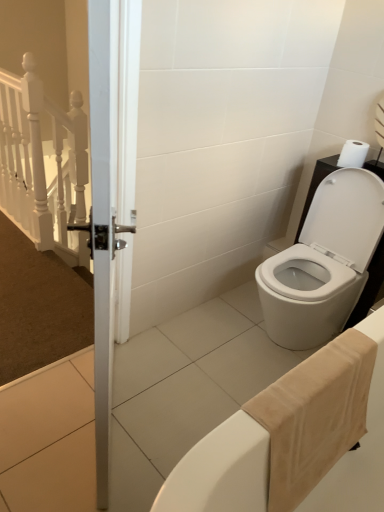
The width and height of the screenshot is (384, 512). What do you see at coordinates (323, 261) in the screenshot?
I see `white glossy toilet at lower right` at bounding box center [323, 261].

Where is `white glossy toilet at lower right`? This screenshot has height=512, width=384. white glossy toilet at lower right is located at coordinates point(323,261).

Measure the distance between point [362,150] and camera.

A distance of 6.33 feet exists between point [362,150] and camera.

The height and width of the screenshot is (512, 384). I want to click on white matte toilet paper at upper right, so click(x=353, y=154).

This screenshot has height=512, width=384. Describe the element at coordinates (314, 416) in the screenshot. I see `beige cotton bath towel at lower right` at that location.

Locate an element on the screen. This screenshot has width=384, height=512. white glossy toilet at lower right is located at coordinates (323, 261).

Consider the image. Is white glossy toilet at lower right positioned with its back to white matte toilet paper at upper right?

No.

Is white glossy toilet at lower right surrounding white matte toilet paper at upper right?

No.

Which object is further away from the camera taking this photo, white glossy toilet at lower right or white matte toilet paper at upper right?

white matte toilet paper at upper right is behind.

Is white glossy toilet at lower right wider or thinner than white matte toilet paper at upper right?

In the image, white glossy toilet at lower right appears to be wider than white matte toilet paper at upper right.

From the picture: From the image's perspective, is white matte toilet paper at upper right beneath beige cotton bath towel at lower right?

Actually, white matte toilet paper at upper right appears above beige cotton bath towel at lower right in the image.

Considering the sizes of objects white matte toilet paper at upper right and beige cotton bath towel at lower right in the image provided, who is smaller, white matte toilet paper at upper right or beige cotton bath towel at lower right?

Smaller between the two is white matte toilet paper at upper right.

From the picture: Considering the positions of objects white matte toilet paper at upper right and beige cotton bath towel at lower right in the image provided, who is in front, white matte toilet paper at upper right or beige cotton bath towel at lower right?

beige cotton bath towel at lower right is more forward.

What are the coordinates of `toilet paper on the right of beige cotton bath towel at lower right` in the screenshot? It's located at (353, 154).

Which object is thinner, beige cotton bath towel at lower right or white matte toilet paper at upper right?

With smaller width is white matte toilet paper at upper right.

What's the angular difference between beige cotton bath towel at lower right and white matte toilet paper at upper right's facing directions?

They differ by 92.2 degrees in their facing directions.

Where is `bath towel on the left of white matte toilet paper at upper right`? This screenshot has height=512, width=384. bath towel on the left of white matte toilet paper at upper right is located at coordinates (314, 416).

Is white matte toilet paper at upper right further to camera compared to white glossy toilet at lower right?

Yes, white matte toilet paper at upper right is further from the camera.

Would you say white matte toilet paper at upper right is a long distance from white glossy toilet at lower right?

No.

Could you tell me if white matte toilet paper at upper right is facing white glossy toilet at lower right?

No, white matte toilet paper at upper right is not facing towards white glossy toilet at lower right.

In the scene shown: Considering the sizes of objects white matte toilet paper at upper right and white glossy toilet at lower right in the image provided, who is shorter, white matte toilet paper at upper right or white glossy toilet at lower right?

Standing shorter between the two is white matte toilet paper at upper right.

Between point (317, 256) and point (332, 374), which one is positioned in front?

The point (332, 374) is closer.

Does white glossy toilet at lower right have a larger size compared to beige cotton bath towel at lower right?

Yes, white glossy toilet at lower right is bigger than beige cotton bath towel at lower right.

From a real-world perspective, does white glossy toilet at lower right stand above beige cotton bath towel at lower right?

No, from a real-world perspective, white glossy toilet at lower right is not on top of beige cotton bath towel at lower right.

Is white glossy toilet at lower right placed right next to beige cotton bath towel at lower right?

No.

Would you say beige cotton bath towel at lower right is a long distance from white glossy toilet at lower right?

No.

From a real-world perspective, is beige cotton bath towel at lower right located higher than white glossy toilet at lower right?

Correct, in the physical world, beige cotton bath towel at lower right is higher than white glossy toilet at lower right.

Does point (277, 476) appear closer or farther from the camera than point (346, 320)?

Clearly, point (277, 476) is closer to the camera than point (346, 320).

Who is taller, beige cotton bath towel at lower right or white glossy toilet at lower right?

Standing taller between the two is white glossy toilet at lower right.

Find the location of a particular element. The width and height of the screenshot is (384, 512). toilet below the white matte toilet paper at upper right (from a real-world perspective) is located at coordinates (323, 261).

Where is `toilet paper located behind the beige cotton bath towel at lower right`? The image size is (384, 512). toilet paper located behind the beige cotton bath towel at lower right is located at coordinates (353, 154).

From the image, which object appears to be farther from beige cotton bath towel at lower right, white matte toilet paper at upper right or white glossy toilet at lower right?

Based on the image, white matte toilet paper at upper right appears to be further to beige cotton bath towel at lower right.

When comparing their distances from white matte toilet paper at upper right, does beige cotton bath towel at lower right or white glossy toilet at lower right seem closer?

The object closer to white matte toilet paper at upper right is white glossy toilet at lower right.

From the image, which object appears to be nearer to white glossy toilet at lower right, beige cotton bath towel at lower right or white matte toilet paper at upper right?

white matte toilet paper at upper right is closer to white glossy toilet at lower right.

From the image, which object appears to be farther from beige cotton bath towel at lower right, white glossy toilet at lower right or white matte toilet paper at upper right?

Among the two, white matte toilet paper at upper right is located further to beige cotton bath towel at lower right.

From the image, which object appears to be farther from white matte toilet paper at upper right, white glossy toilet at lower right or beige cotton bath towel at lower right?

beige cotton bath towel at lower right.

From the image, which object appears to be farther from white glossy toilet at lower right, white matte toilet paper at upper right or beige cotton bath towel at lower right?

Based on the image, beige cotton bath towel at lower right appears to be further to white glossy toilet at lower right.

Where is `toilet between beige cotton bath towel at lower right and white matte toilet paper at upper right along the z-axis`? The height and width of the screenshot is (512, 384). toilet between beige cotton bath towel at lower right and white matte toilet paper at upper right along the z-axis is located at coordinates (323, 261).